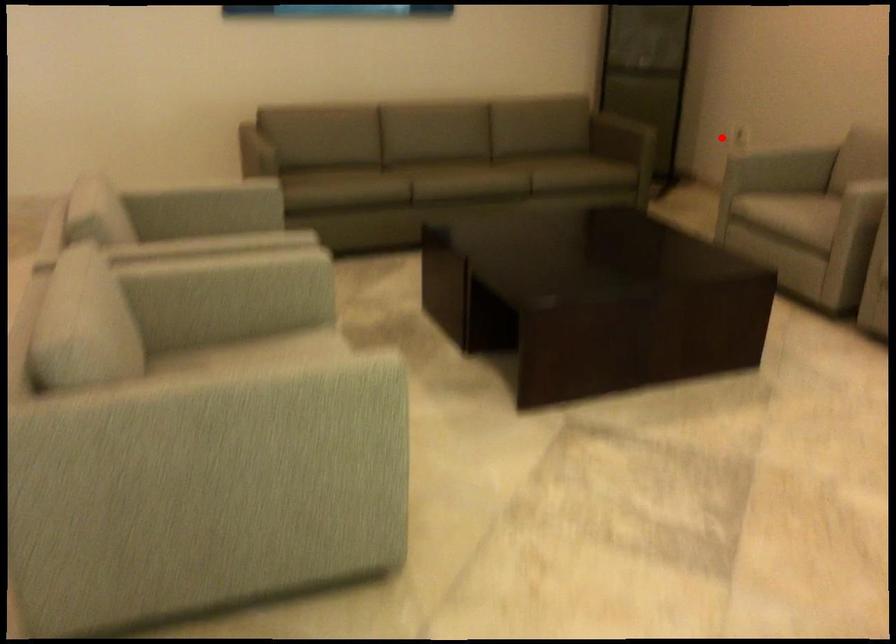
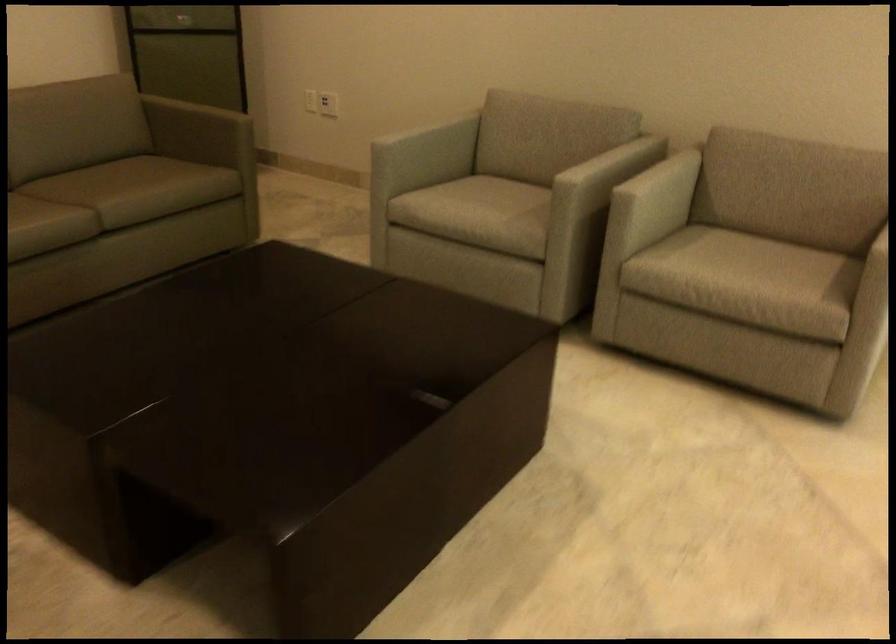
Question: I am providing you with two images of the same scene from different viewpoints. Given a red point in image1, look at the same physical point in image2. Is it:

Choices:
 (A) Closer to the viewpoint
 (B) Farther from the viewpoint

Answer: (A)